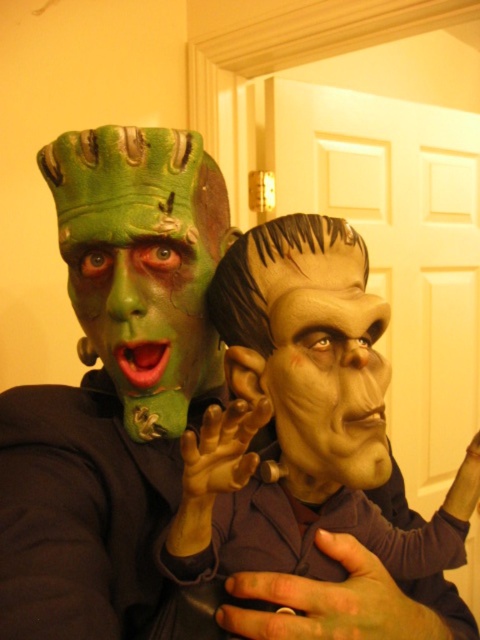
Question: Where is green matte frankenstein mask at left located in relation to green matte frankenstein mask at center in the image?

Choices:
 (A) left
 (B) right

Answer: (A)

Question: Which object appears closest to the camera in this image?

Choices:
 (A) green matte frankenstein mask at left
 (B) green matte frankenstein mask at center

Answer: (B)

Question: Is green matte frankenstein mask at left to the right of green matte frankenstein mask at center from the viewer's perspective?

Choices:
 (A) yes
 (B) no

Answer: (B)

Question: Which point is closer to the camera?

Choices:
 (A) (294, 280)
 (B) (143, 340)

Answer: (A)

Question: Which point is closer to the camera?

Choices:
 (A) green matte frankenstein mask at center
 (B) green matte frankenstein mask at left

Answer: (A)

Question: From the image, what is the correct spatial relationship of green matte frankenstein mask at left in relation to green matte frankenstein mask at center?

Choices:
 (A) right
 (B) left

Answer: (B)